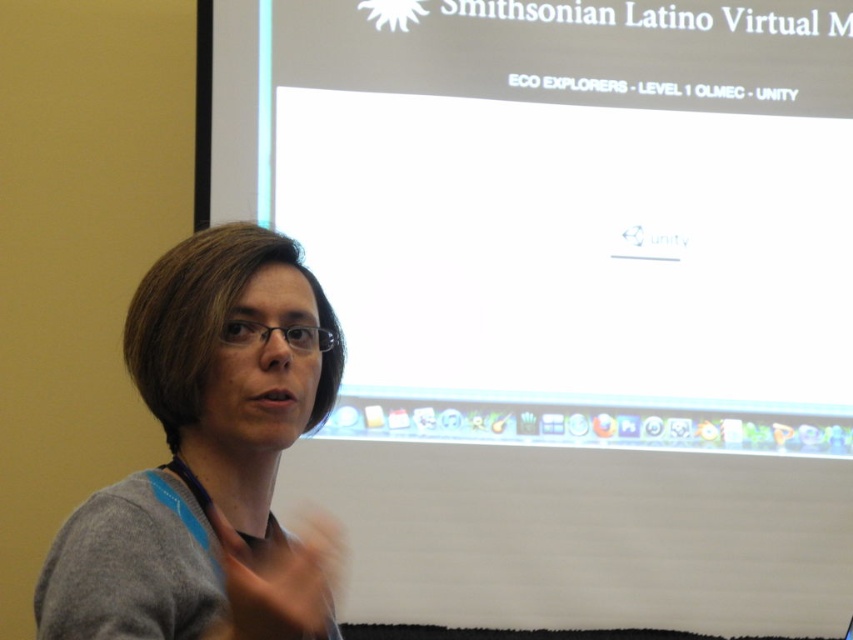
Question: Which point is closer to the camera?

Choices:
 (A) white glossy projector screen at upper center
 (B) gray matte sweater at left

Answer: (B)

Question: Is white glossy projector screen at upper center to the right of gray matte sweater at left from the viewer's perspective?

Choices:
 (A) no
 (B) yes

Answer: (B)

Question: Does white glossy projector screen at upper center come behind gray matte sweater at left?

Choices:
 (A) no
 (B) yes

Answer: (B)

Question: Can you confirm if white glossy projector screen at upper center is positioned to the right of gray matte sweater at left?

Choices:
 (A) no
 (B) yes

Answer: (B)

Question: Which of the following is the farthest from the observer?

Choices:
 (A) white glossy projector screen at upper center
 (B) gray matte sweater at left

Answer: (A)

Question: Which point is farther from the camera taking this photo?

Choices:
 (A) (631, 368)
 (B) (219, 324)

Answer: (A)